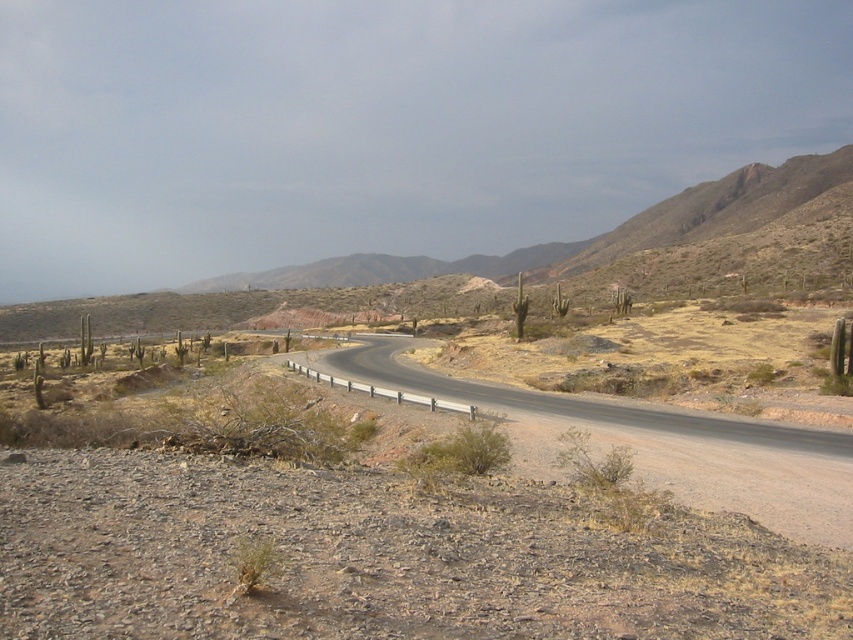
You are driving a car and see the black asphalt road at center and the brown rocky mountain at center. Which object is closer to you as you drive along the road?

The black asphalt road at center is closer to you because it is in front of the brown rocky mountain at center.

You are driving a truck that requires a road with a minimum width of 10 meters. You see the brown dirt road at center and the black asphalt road at center. Which road should you choose to ensure your truck can pass safely?

The brown dirt road at center has a larger size compared to the black asphalt road at center, so you should choose the brown dirt road at center to ensure your truck can pass safely as it meets the minimum width requirement.